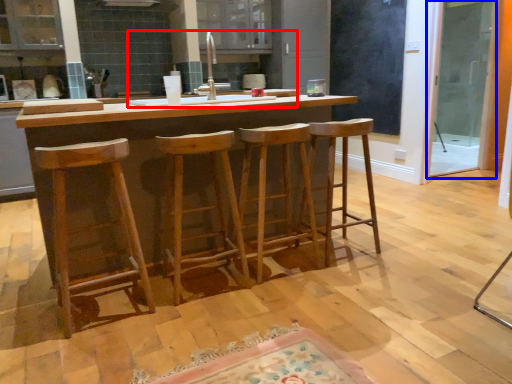
Question: Which object appears farthest to the camera in this image, sink (highlighted by a red box) or screen door (highlighted by a blue box)?

Choices:
 (A) sink
 (B) screen door

Answer: (B)